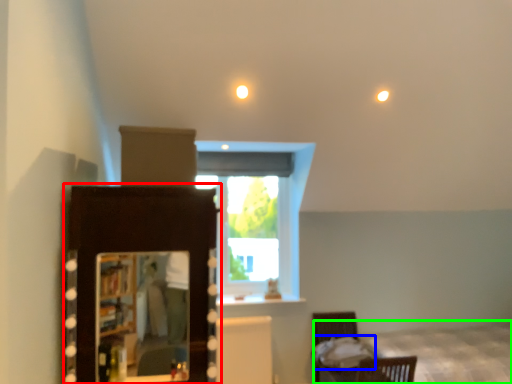
Question: Based on their relative distances, which object is farther from dresser (highlighted by a red box)? Choose from sheet (highlighted by a blue box) and bed (highlighted by a green box).

Choices:
 (A) sheet
 (B) bed

Answer: (B)